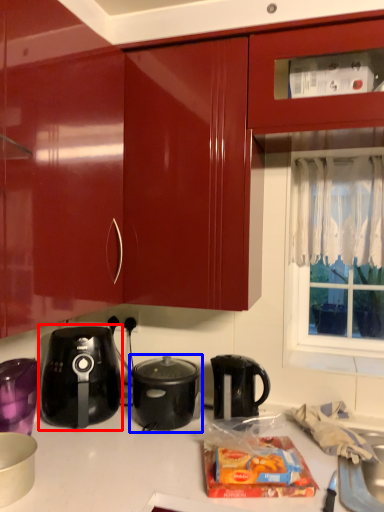
Question: Among these objects, which one is nearest to the camera, kettle (highlighted by a red box) or kitchen appliance (highlighted by a blue box)?

Choices:
 (A) kettle
 (B) kitchen appliance

Answer: (A)